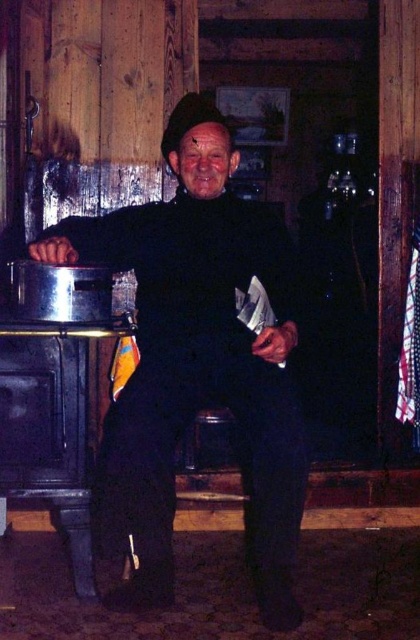
You are standing in the room and want to determine which of the two points, point (x=102, y=321) or point (x=62, y=332), is closer to you. Based on the scene, which point is nearer?

Point (x=102, y=321) is closer to you than point (x=62, y=332) because it is further to the viewer according to the description.

You are standing in the room and want to determine which of the two points, point [167,248] or point [128,323], is closer to you. Based on the scene description, which point is nearer?

Point [167,248] is further to the viewer than point [128,323], so the closer point to you is point [128,323].